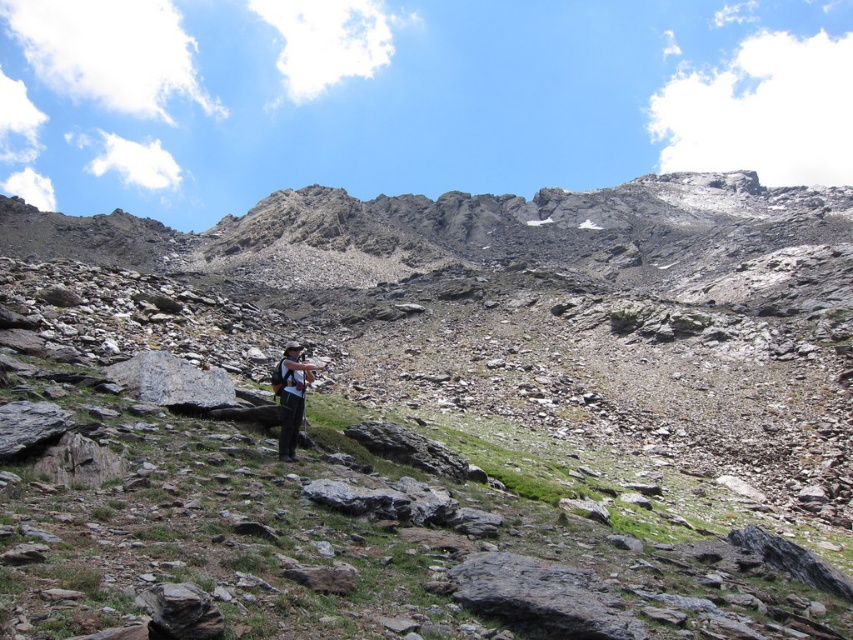
Question: From the image, what is the correct spatial relationship of gray rocky mountain at center in relation to matte black backpack at center?

Choices:
 (A) below
 (B) above

Answer: (B)

Question: Is gray rocky mountain at center bigger than matte black backpack at center?

Choices:
 (A) no
 (B) yes

Answer: (B)

Question: Which of the following is the closest to the observer?

Choices:
 (A) matte black backpack at center
 (B) gray rocky mountain at center

Answer: (B)

Question: Where is gray rocky mountain at center located in relation to matte black backpack at center in the image?

Choices:
 (A) below
 (B) above

Answer: (B)

Question: Which object is farther from the camera taking this photo?

Choices:
 (A) gray rocky mountain at center
 (B) matte black backpack at center

Answer: (B)